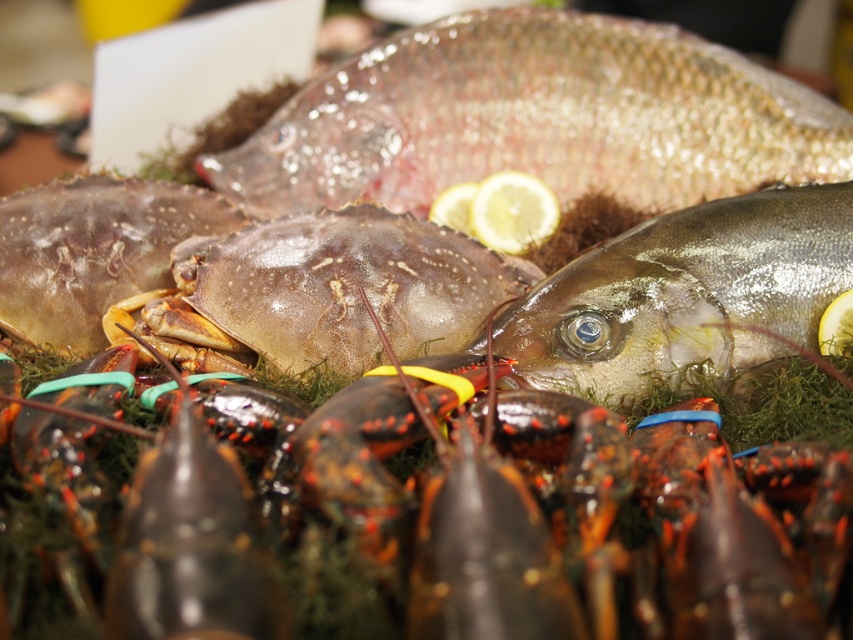
Between shiny silver fish at center and yellow matte lemon at center, which one has less height?

yellow matte lemon at center

Is shiny silver fish at center smaller than yellow matte lemon at center?

Incorrect, shiny silver fish at center is not smaller in size than yellow matte lemon at center.

Between point (787, 272) and point (532, 218), which one is positioned behind?

The point (532, 218) is behind.

This screenshot has height=640, width=853. In order to click on shiny silver fish at center in this screenshot , I will do `click(686, 294)`.

Is translucent brown crab at center wider than yellow matte lemon at center?

Yes.

Between point (189, 355) and point (549, 221), which one is positioned in front?

Point (189, 355) is more forward.

The width and height of the screenshot is (853, 640). Find the location of `translucent brown crab at center`. translucent brown crab at center is located at coordinates (325, 292).

Who is positioned more to the left, shiny silver fish at center or shiny brown crab at center?

shiny brown crab at center

Is point (741, 323) positioned after point (177, 216)?

No, it is in front of (177, 216).

Locate an element on the screen. Image resolution: width=853 pixels, height=640 pixels. shiny silver fish at center is located at coordinates (686, 294).